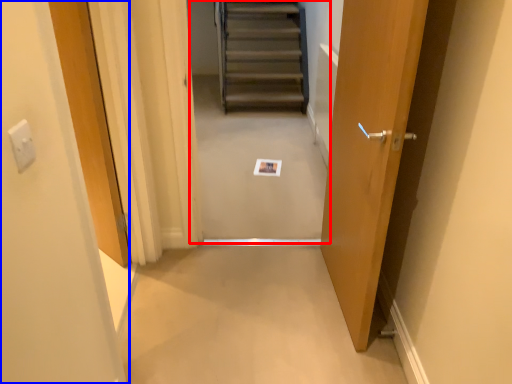
Question: Which object is closer to the camera taking this photo, escalator (highlighted by a red box) or door (highlighted by a blue box)?

Choices:
 (A) escalator
 (B) door

Answer: (B)